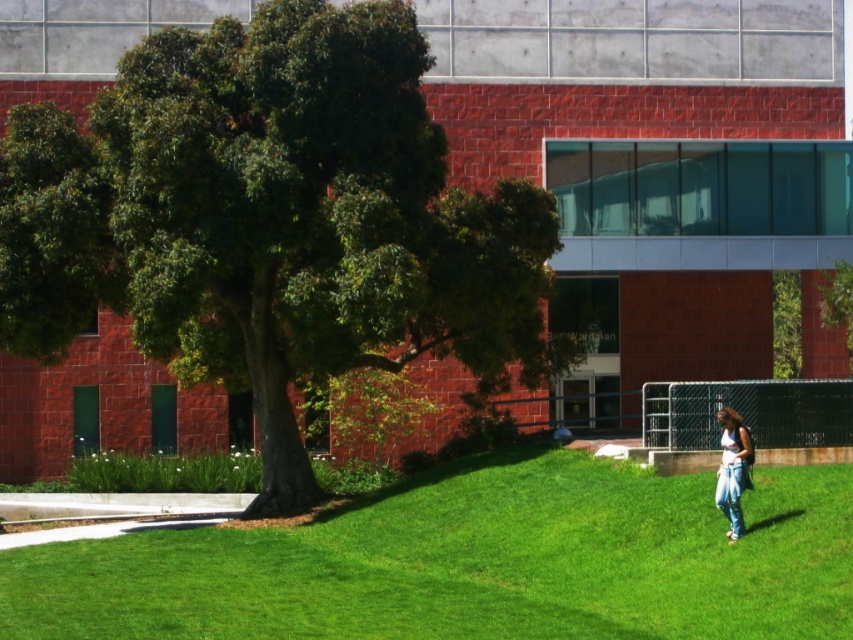
Between point (210, 92) and point (718, 492), which one is positioned behind?

The point (210, 92) is behind.

Can you confirm if green leafy tree at center is positioned to the left of jeans at lower right?

Yes, green leafy tree at center is to the left of jeans at lower right.

The image size is (853, 640). Find the location of `green leafy tree at center`. green leafy tree at center is located at coordinates (271, 220).

Where is `green leafy tree at center`? Image resolution: width=853 pixels, height=640 pixels. green leafy tree at center is located at coordinates (271, 220).